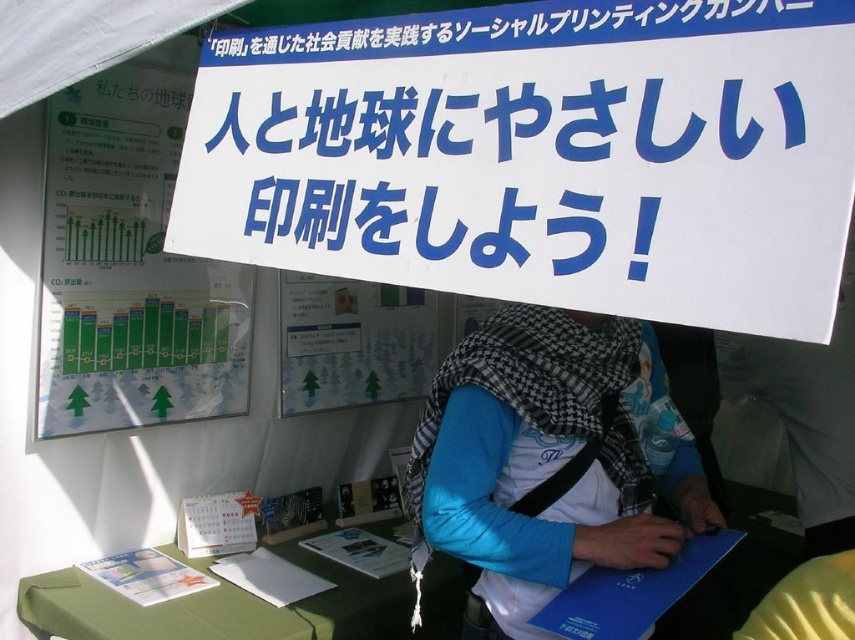
Question: Among these objects, which one is farthest from the camera?

Choices:
 (A) white paper sign at upper center
 (B) green paper at left
 (C) blue cotton shirt at center

Answer: (B)

Question: In this image, where is blue cotton shirt at center located relative to green paper at left?

Choices:
 (A) below
 (B) above

Answer: (A)

Question: Estimate the real-world distances between objects in this image. Which object is farther from the white paper sign at upper center?

Choices:
 (A) blue cotton shirt at center
 (B) green paper at left

Answer: (B)

Question: Considering the relative positions of blue cotton shirt at center and green paper at left in the image provided, where is blue cotton shirt at center located with respect to green paper at left?

Choices:
 (A) below
 (B) above

Answer: (A)

Question: Is blue cotton shirt at center wider than green paper at left?

Choices:
 (A) no
 (B) yes

Answer: (B)

Question: Which object appears farthest from the camera in this image?

Choices:
 (A) white paper sign at upper center
 (B) blue cotton shirt at center

Answer: (B)